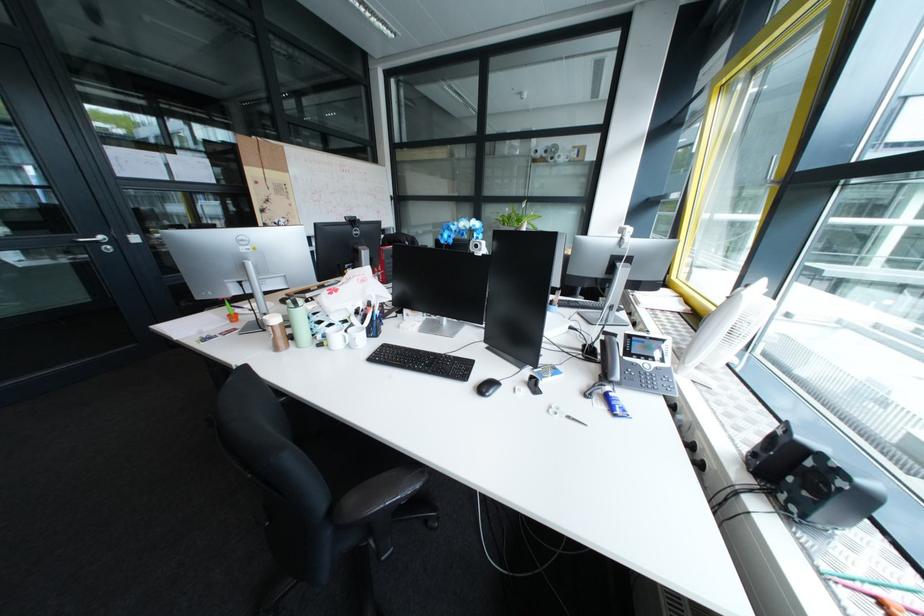
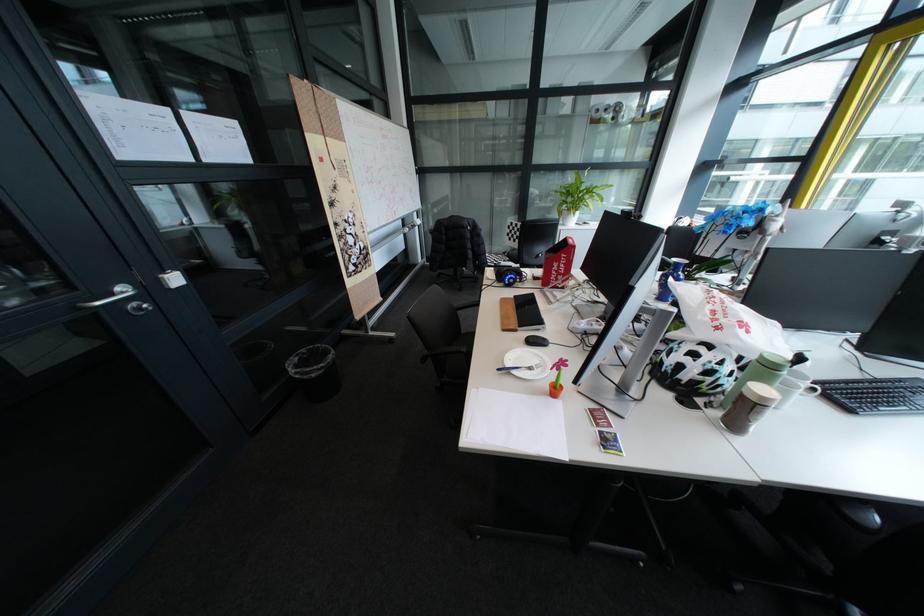
Where in the second image is the point corresponding to pixel 120 249 from the first image?

(152, 309)